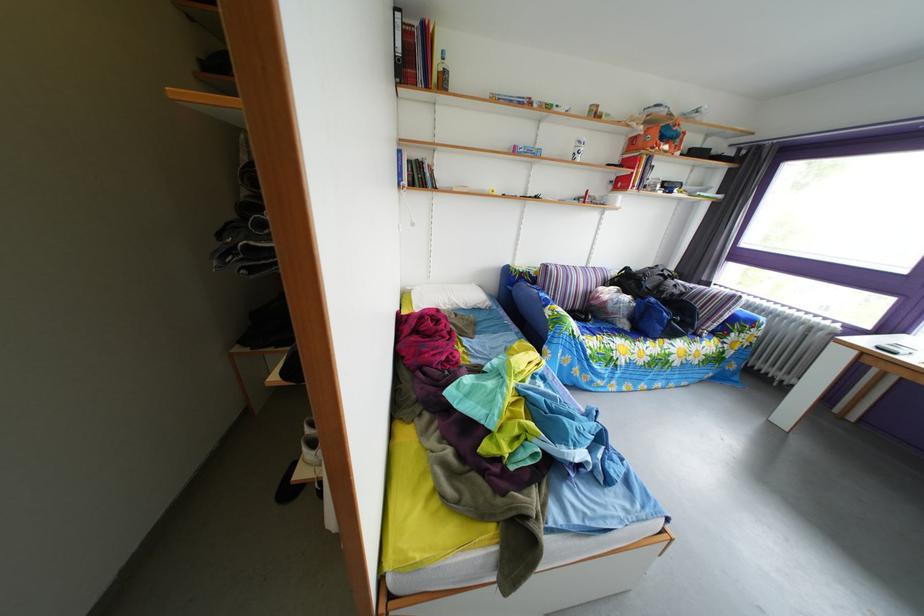
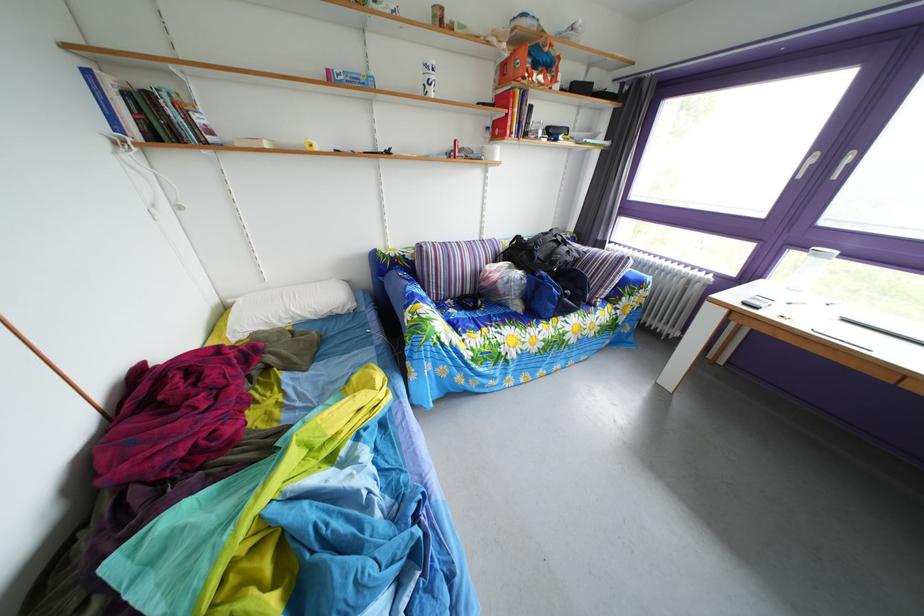
In a continuous first-person perspective shot, in which direction is the camera moving?

The cameraman moved toward right, forward.